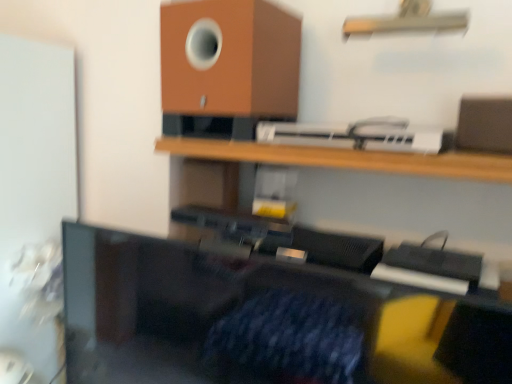
Question: Is black plastic monitor at center surrounded by metallic silver shelf at upper center, positioned as the 1th shelf in top-to-bottom order?

Choices:
 (A) no
 (B) yes

Answer: (A)

Question: Can you see metallic silver shelf at upper center, marked as the 2th shelf in a bottom-to-top arrangement, touching black plastic monitor at center?

Choices:
 (A) yes
 (B) no

Answer: (B)

Question: Considering the relative sizes of metallic silver shelf at upper center, positioned as the 1th shelf in top-to-bottom order, and black plastic monitor at center in the image provided, is metallic silver shelf at upper center, positioned as the 1th shelf in top-to-bottom order, shorter than black plastic monitor at center?

Choices:
 (A) no
 (B) yes

Answer: (B)

Question: Can you confirm if metallic silver shelf at upper center, positioned as the 1th shelf in top-to-bottom order, is smaller than black plastic monitor at center?

Choices:
 (A) yes
 (B) no

Answer: (A)

Question: From the image's perspective, would you say metallic silver shelf at upper center, marked as the 2th shelf in a bottom-to-top arrangement, is shown under black plastic monitor at center?

Choices:
 (A) no
 (B) yes

Answer: (A)

Question: Considering the relative sizes of wooden shelf at upper center, the first shelf ordered from the bottom, and white plastic printer at upper center in the image provided, is wooden shelf at upper center, the first shelf ordered from the bottom, bigger than white plastic printer at upper center?

Choices:
 (A) no
 (B) yes

Answer: (B)

Question: From the image's perspective, is wooden shelf at upper center, the second shelf positioned from the top, above white plastic printer at upper center?

Choices:
 (A) yes
 (B) no

Answer: (B)

Question: Could you tell me if wooden shelf at upper center, the first shelf ordered from the bottom, is facing white plastic printer at upper center?

Choices:
 (A) yes
 (B) no

Answer: (B)

Question: From a real-world perspective, is wooden shelf at upper center, the second shelf positioned from the top, below white plastic printer at upper center?

Choices:
 (A) no
 (B) yes

Answer: (B)

Question: From a real-world perspective, is wooden shelf at upper center, the second shelf positioned from the top, located higher than white plastic printer at upper center?

Choices:
 (A) yes
 (B) no

Answer: (B)

Question: Considering the relative sizes of wooden shelf at upper center, the first shelf ordered from the bottom, and white plastic printer at upper center in the image provided, is wooden shelf at upper center, the first shelf ordered from the bottom, shorter than white plastic printer at upper center?

Choices:
 (A) no
 (B) yes

Answer: (B)

Question: Is white plastic printer at upper center inside brown matte speaker at upper center?

Choices:
 (A) yes
 (B) no

Answer: (B)